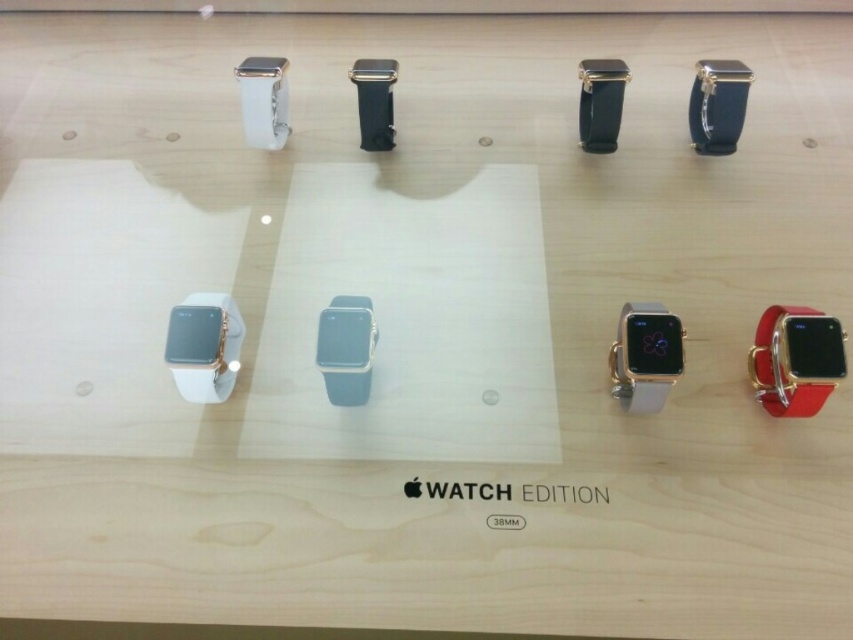
You are an Apple store employee and need to place a new watch in the display. The new watch must be smaller than the white matte apple watch at lower left but larger than the black leather watch at center. Is there enough space between them to fit the new watch?

The white matte apple watch at lower left is larger than the black leather watch at center, so there is a size gap between them. Therefore, a new watch smaller than the white matte apple watch at lower left but larger than the black leather watch at center can fit in that space.

You are setting up a display for the Apple Watch Editions. You need to place a new watch next to the white matte apple watch at lower left without overlapping. Where should you position it based on its coordinates?

The white matte apple watch at lower left is located at point (204, 344). To place the new watch next to it without overlapping, ensure it is positioned at a coordinate that does not overlap with these coordinates.